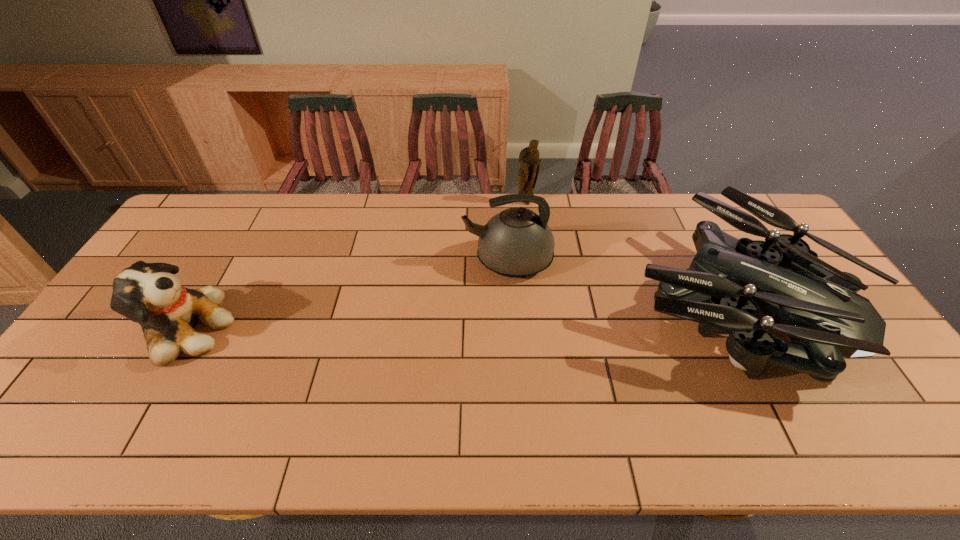
I want to click on figurine that is at the far edge, so click(x=529, y=162).

Find the location of a particular element. This screenshot has width=960, height=540. drone present at the far edge is located at coordinates (730, 281).

What are the coordinates of `object at the left edge` in the screenshot? It's located at (149, 294).

You are a GUI agent. You are given a task and a screenshot of the screen. Output one action in this format:
    pyautogui.click(x=<x>, y=<y>)
    Task: Click on the object located at the right edge
    The height and width of the screenshot is (540, 960).
    Given the screenshot: What is the action you would take?
    pyautogui.click(x=730, y=281)

The image size is (960, 540). Identify the location of object that is at the far right corner. (730, 281).

At what (x,y) coordinates should I click in order to perform the action: click on free region at the far edge. Please return your answer as a coordinate pair (x, y). The width and height of the screenshot is (960, 540). Looking at the image, I should click on (688, 212).

In the image, there is a desktop. Where is `free space at the right edge`? The width and height of the screenshot is (960, 540). free space at the right edge is located at coordinates (867, 368).

In order to click on vacant space at the far left corner of the desktop in this screenshot , I will do `click(226, 199)`.

Locate an element on the screen. This screenshot has width=960, height=540. blank region between the rightmost object and the figurine is located at coordinates (628, 253).

The image size is (960, 540). I want to click on free space between the leftmost object and the kettle, so click(346, 295).